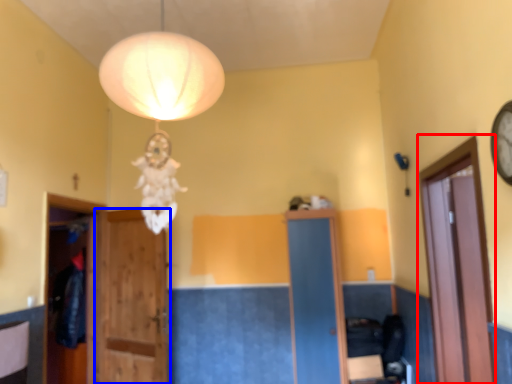
Question: Which object is further to the camera taking this photo, glass door (highlighted by a red box) or door (highlighted by a blue box)?

Choices:
 (A) glass door
 (B) door

Answer: (B)